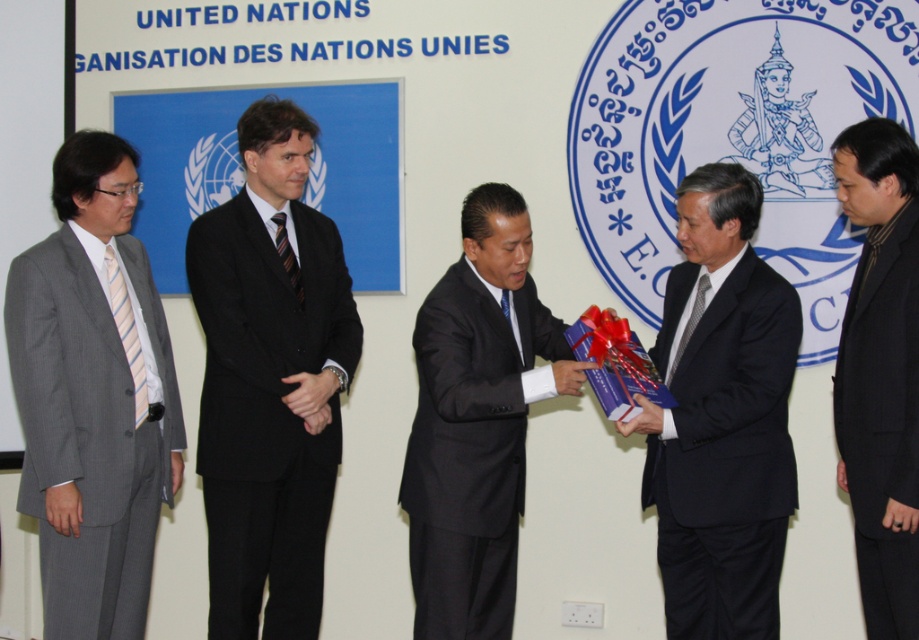
Question: Can you confirm if black matte suit at center is smaller than matte black suit at center?

Choices:
 (A) no
 (B) yes

Answer: (B)

Question: Which of the following is the farthest from the observer?

Choices:
 (A) black pinstripe suit at center
 (B) black matte suit at center
 (C) gray pinstripe suit at left
 (D) black matte suit at right

Answer: (A)

Question: Which of the following is the farthest from the observer?

Choices:
 (A) silky black tie at center
 (B) black pinstripe suit at center
 (C) matte black suit at center
 (D) black matte suit at center

Answer: (B)

Question: Can you confirm if black matte suit at right is positioned to the left of striped fabric tie at left?

Choices:
 (A) yes
 (B) no

Answer: (B)

Question: Considering the relative positions of matte black suit at center and striped fabric tie at center in the image provided, where is matte black suit at center located with respect to striped fabric tie at center?

Choices:
 (A) above
 (B) below

Answer: (B)

Question: Which point appears farthest from the camera in this image?

Choices:
 (A) (285, 246)
 (B) (172, 372)
 (C) (694, 320)

Answer: (B)